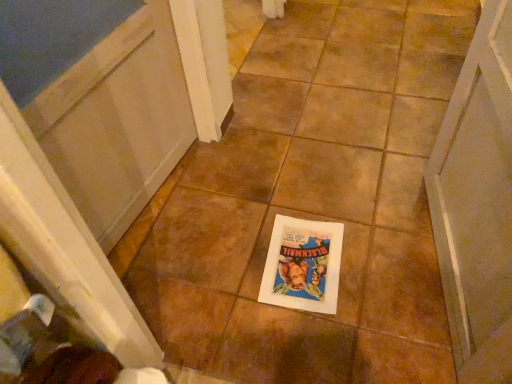
The height and width of the screenshot is (384, 512). I want to click on space that is in front of matte paper book at center, so click(x=315, y=342).